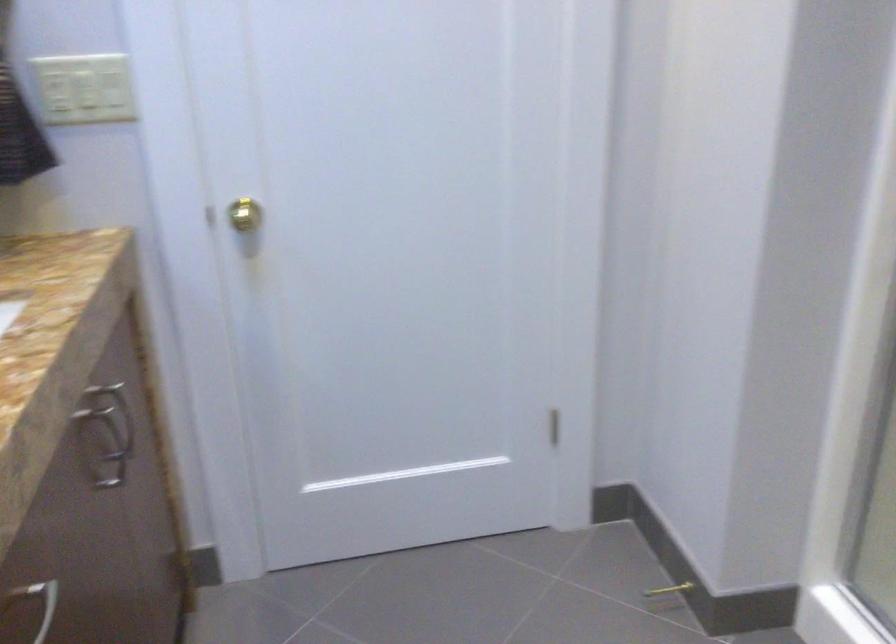
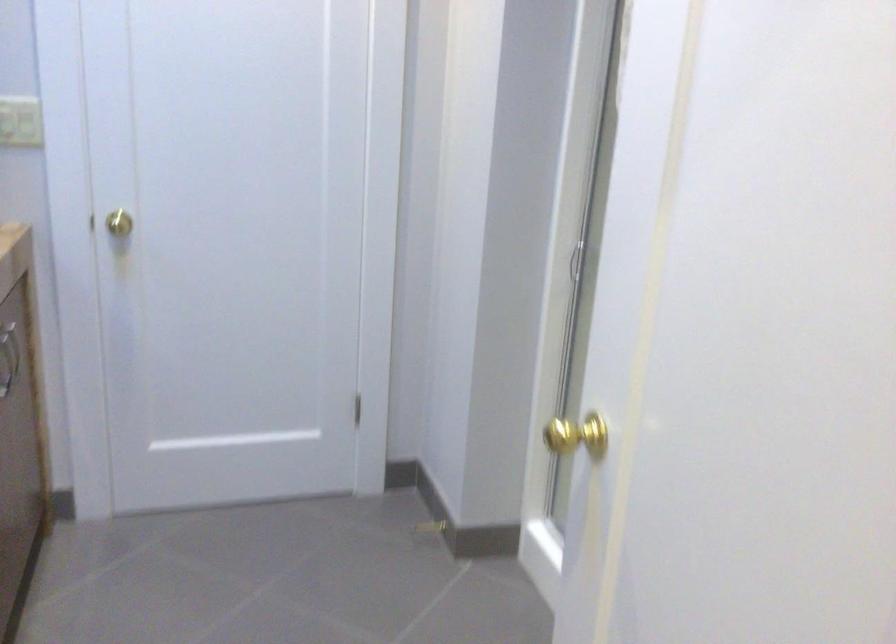
Question: How did the camera likely rotate?

Choices:
 (A) Left
 (B) Right
 (C) Up
 (D) Down

Answer: (B)